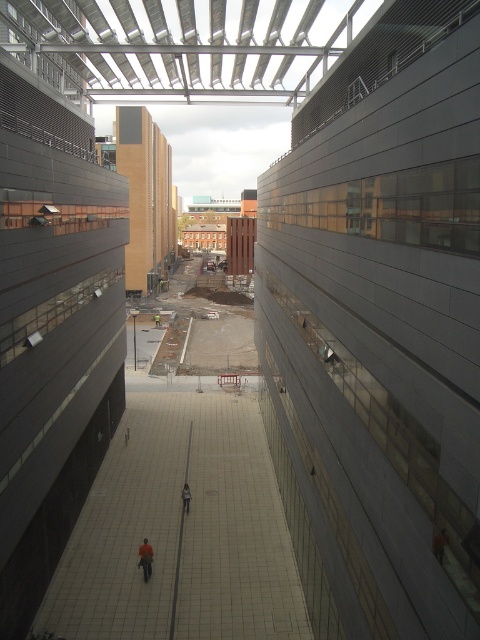
You are a photographer standing on the balcony looking down at the pathway. You notice the orange fabric person at center and the dark gray jacket at center. Which of these two people appears taller in the image?

The orange fabric person at center appears much taller than the dark gray jacket at center in the image.

You are standing on the pathway in the urban environment shown. If you face the direction of the buildings, which direction should you walk to reach the white tile floor at center marked by point (x=180, y=531)?

The white tile floor at center marked by point (x=180, y=531) is located directly in front of you along the pathway. Since you are facing the buildings, you should walk straight ahead towards the center of the pathway to reach it.

You are standing on the balcony looking down at the pathway. You see an orange fabric person at center and a dark gray jacket at center. Which one is closer to you?

The orange fabric person at center is closer to you because they are in front of the dark gray jacket at center.